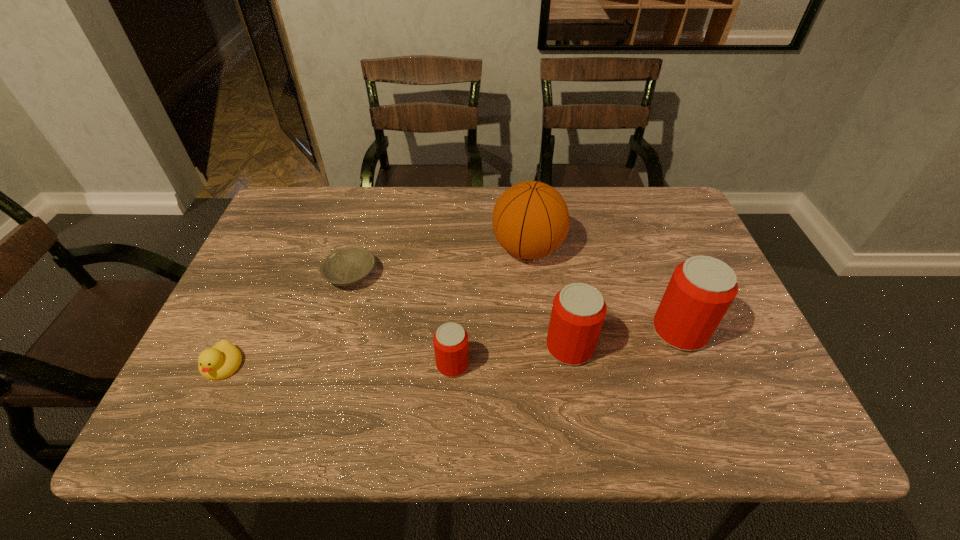
Identify the location of the leftmost beer can. (450, 340).

You are a GUI agent. You are given a task and a screenshot of the screen. Output one action in this format:
    pyautogui.click(x=<x>, y=<y>)
    Task: Click on the third object from left to right
    
    Given the screenshot: What is the action you would take?
    pyautogui.click(x=450, y=340)

Locate an element on the screen. the second shortest beer can is located at coordinates (578, 311).

Locate an element on the screen. The image size is (960, 540). the third tallest object is located at coordinates (578, 311).

You are a GUI agent. You are given a task and a screenshot of the screen. Output one action in this format:
    pyautogui.click(x=<x>, y=<y>)
    Task: Click on the rightmost object
    The width and height of the screenshot is (960, 540).
    Given the screenshot: What is the action you would take?
    pyautogui.click(x=701, y=289)

Locate an element on the screen. bowl is located at coordinates (348, 266).

Locate an element on the screen. the shortest object is located at coordinates (348, 266).

Find the location of `basketball`. basketball is located at coordinates (530, 220).

At what (x,y) coordinates should I click in order to perform the action: click on duckling. Please return your answer as a coordinate pair (x, y). This screenshot has width=960, height=540. Looking at the image, I should click on (223, 359).

You are a GUI agent. You are given a task and a screenshot of the screen. Output one action in this format:
    pyautogui.click(x=<x>, y=<y>)
    Task: Click on the fifth tallest object
    
    Given the screenshot: What is the action you would take?
    pyautogui.click(x=223, y=359)